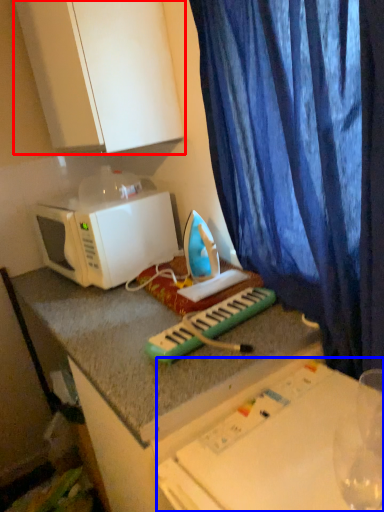
Question: Which object appears farthest to the camera in this image, cabinetry (highlighted by a red box) or table (highlighted by a blue box)?

Choices:
 (A) cabinetry
 (B) table

Answer: (A)